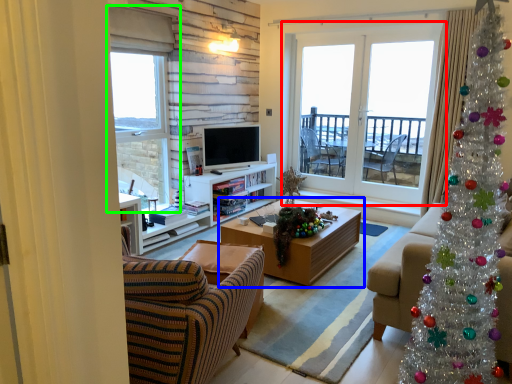
Question: Considering the real-world distances, which object is closest to window (highlighted by a red box)? coffee table (highlighted by a blue box) or window (highlighted by a green box).

Choices:
 (A) coffee table
 (B) window

Answer: (A)